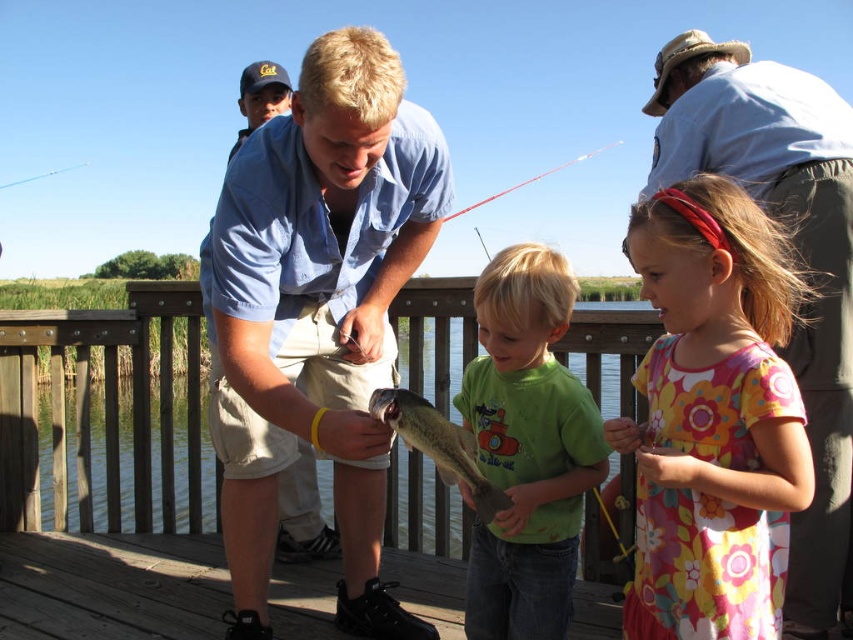
You are a photographer trying to capture a photo of the shiny silver fish at center without the green matte shirt at center overlapping it. Based on their sizes, is this possible?

The green matte shirt at center is wider than the shiny silver fish at center, so it might be challenging to avoid overlapping them in the photo. Adjust your angle or position to ensure the shirt doesn

You are a photographer trying to capture a group photo of the two children in the scene. The floral cotton dress at center and the green matte shirt at center are both in the frame. Based on their positions, which child should you position closer to the center to ensure both are equally visible?

The floral cotton dress at center might be wider than green matte shirt at center, so positioning the child in the green matte shirt at center slightly closer to the center would balance their visibility since the dress takes up more space.